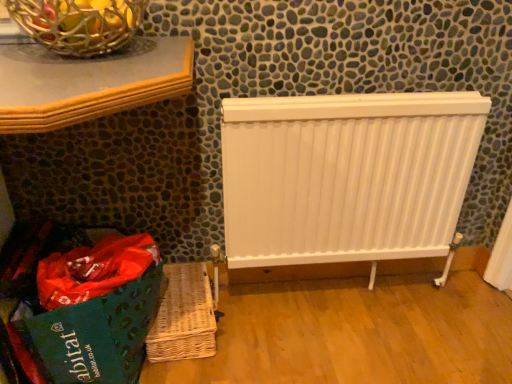
This screenshot has width=512, height=384. What do you see at coordinates (130, 304) in the screenshot? I see `green fabric shopping bag at lower left` at bounding box center [130, 304].

What do you see at coordinates (79, 24) in the screenshot? This screenshot has height=384, width=512. I see `metallic wire basket at upper left` at bounding box center [79, 24].

Where is `woven brown basket at lower left`? The image size is (512, 384). woven brown basket at lower left is located at coordinates (183, 316).

Describe the element at coordinates (346, 176) in the screenshot. The height and width of the screenshot is (384, 512). I see `white matte radiator at center` at that location.

This screenshot has width=512, height=384. Identify the location of green fabric shopping bag at lower left. (130, 304).

From the image's perspective, is green fabric shopping bag at lower left below woven brown basket at lower left?

No, from the image's perspective, green fabric shopping bag at lower left is not below woven brown basket at lower left.

From a real-world perspective, is green fabric shopping bag at lower left positioned above or below woven brown basket at lower left?

Clearly, from a real-world perspective, green fabric shopping bag at lower left is above woven brown basket at lower left.

Which of these two, green fabric shopping bag at lower left or woven brown basket at lower left, is wider?

green fabric shopping bag at lower left.

Would you say woven brown basket at lower left is part of white matte radiator at center's contents?

No.

From the image's perspective, would you say white matte radiator at center is positioned over woven brown basket at lower left?

Yes, from the image's perspective, white matte radiator at center is over woven brown basket at lower left.

This screenshot has height=384, width=512. Find the location of `basket below the white matte radiator at center (from the image's perspective)`. basket below the white matte radiator at center (from the image's perspective) is located at coordinates (183, 316).

Is white matte radiator at center bigger or smaller than woven brown basket at lower left?

In the image, white matte radiator at center appears to be larger than woven brown basket at lower left.

Are woven brown basket at lower left and white matte radiator at center located far from each other?

They are positioned close to each other.

Who is bigger, woven brown basket at lower left or white matte radiator at center?

With larger size is white matte radiator at center.

Can you confirm if woven brown basket at lower left is shorter than white matte radiator at center?

Indeed, woven brown basket at lower left has a lesser height compared to white matte radiator at center.

Measure the distance between woven brown basket at lower left and white matte radiator at center.

The distance of woven brown basket at lower left from white matte radiator at center is 19.75 inches.

From the picture: Is white matte radiator at center completely or partially outside of metallic wire basket at upper left?

Indeed, white matte radiator at center is completely outside metallic wire basket at upper left.

From a real-world perspective, is white matte radiator at center positioned over metallic wire basket at upper left based on gravity?

Actually, white matte radiator at center is physically below metallic wire basket at upper left in the real world.

How much distance is there between white matte radiator at center and metallic wire basket at upper left?

They are 27.88 inches apart.

From the image's perspective, which is below, white matte radiator at center or metallic wire basket at upper left?

white matte radiator at center, from the image's perspective.

Which object is positioned more to the left, green fabric shopping bag at lower left or white matte radiator at center?

From the viewer's perspective, green fabric shopping bag at lower left appears more on the left side.

In terms of size, does green fabric shopping bag at lower left appear bigger or smaller than white matte radiator at center?

green fabric shopping bag at lower left is bigger than white matte radiator at center.

Considering the points (153, 261) and (439, 167), which point is in front, point (153, 261) or point (439, 167)?

Point (153, 261)

Which of these two, woven brown basket at lower left or green fabric shopping bag at lower left, stands taller?

With more height is green fabric shopping bag at lower left.

Which is more to the right, woven brown basket at lower left or green fabric shopping bag at lower left?

Positioned to the right is woven brown basket at lower left.

From a real-world perspective, is woven brown basket at lower left below green fabric shopping bag at lower left?

Yes, from a real-world perspective, woven brown basket at lower left is under green fabric shopping bag at lower left.

How distant is woven brown basket at lower left from green fabric shopping bag at lower left?

woven brown basket at lower left and green fabric shopping bag at lower left are 6.42 inches apart.

Is white matte radiator at center smaller than green fabric shopping bag at lower left?

Yes.

How many degrees apart are the facing directions of white matte radiator at center and green fabric shopping bag at lower left?

0.228 degrees.

From the image's perspective, would you say white matte radiator at center is positioned over green fabric shopping bag at lower left?

Yes, from the image's perspective, white matte radiator at center is on top of green fabric shopping bag at lower left.

Which is correct: white matte radiator at center is inside green fabric shopping bag at lower left, or outside of it?

white matte radiator at center is located beyond the bounds of green fabric shopping bag at lower left.

The image size is (512, 384). I want to click on shopping bag on the left side of woven brown basket at lower left, so click(130, 304).

Where is `radiator that appears above the woven brown basket at lower left (from a real-world perspective)`? This screenshot has width=512, height=384. radiator that appears above the woven brown basket at lower left (from a real-world perspective) is located at coordinates (346, 176).

Based on their spatial positions, is woven brown basket at lower left or white matte radiator at center closer to green fabric shopping bag at lower left?

woven brown basket at lower left is positioned closer to the anchor green fabric shopping bag at lower left.

Looking at the image, which one is located closer to green fabric shopping bag at lower left, metallic wire basket at upper left or woven brown basket at lower left?

Based on the image, woven brown basket at lower left appears to be nearer to green fabric shopping bag at lower left.

Looking at the image, which one is located further to metallic wire basket at upper left, green fabric shopping bag at lower left or woven brown basket at lower left?

Based on the image, woven brown basket at lower left appears to be further to metallic wire basket at upper left.

Consider the image. Which object lies nearer to the anchor point white matte radiator at center, metallic wire basket at upper left or woven brown basket at lower left?

woven brown basket at lower left lies closer to white matte radiator at center than the other object.

Looking at the image, which one is located further to metallic wire basket at upper left, woven brown basket at lower left or green fabric shopping bag at lower left?

woven brown basket at lower left.

From the picture: Looking at the image, which one is located further to metallic wire basket at upper left, green fabric shopping bag at lower left or white matte radiator at center?

white matte radiator at center is further to metallic wire basket at upper left.

When comparing their distances from white matte radiator at center, does woven brown basket at lower left or metallic wire basket at upper left seem closer?

woven brown basket at lower left is closer to white matte radiator at center.

Based on their spatial positions, is green fabric shopping bag at lower left or white matte radiator at center further from woven brown basket at lower left?

Based on the image, white matte radiator at center appears to be further to woven brown basket at lower left.

The image size is (512, 384). I want to click on basket between green fabric shopping bag at lower left and white matte radiator at center, so click(x=183, y=316).

You are a GUI agent. You are given a task and a screenshot of the screen. Output one action in this format:
    pyautogui.click(x=<x>, y=<y>)
    Task: Click on the shopping bag between metallic wire basket at upper left and woven brown basket at lower left from top to bottom
    
    Given the screenshot: What is the action you would take?
    pyautogui.click(x=130, y=304)

Locate an element on the screen. basket container located between green fabric shopping bag at lower left and white matte radiator at center in the left-right direction is located at coordinates (79, 24).

Where is `radiator that lies between metallic wire basket at upper left and woven brown basket at lower left from top to bottom`? This screenshot has width=512, height=384. radiator that lies between metallic wire basket at upper left and woven brown basket at lower left from top to bottom is located at coordinates (346, 176).